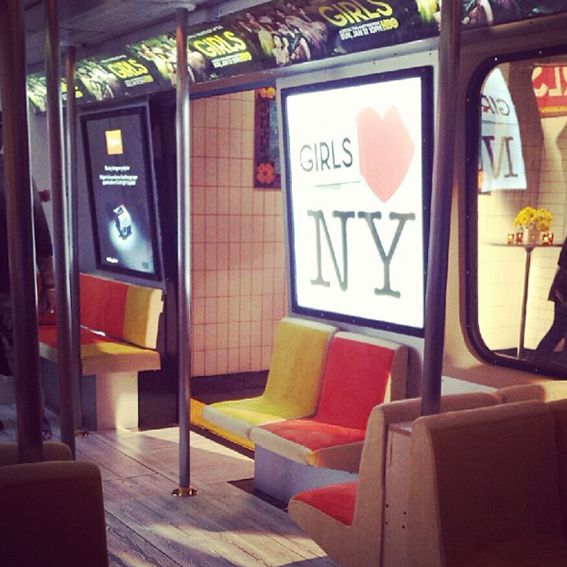
Where is `floor`? This screenshot has height=567, width=567. floor is located at coordinates (136, 540).